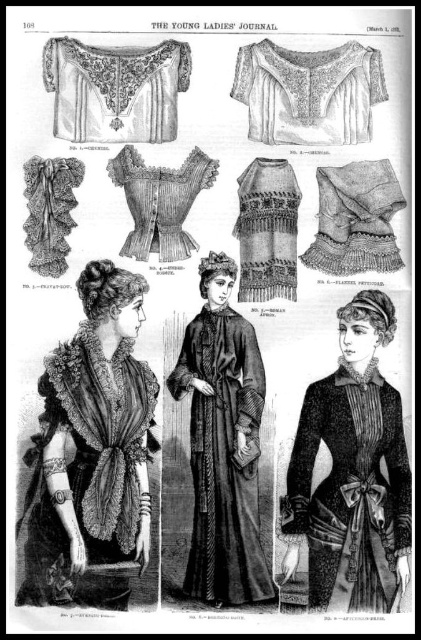
Between white lace blouse at upper center and matte white lace blouse at upper left, which one has more height?

Standing taller between the two is white lace blouse at upper center.

Does white lace blouse at upper center appear on the right side of matte white lace blouse at upper left?

Yes, white lace blouse at upper center is to the right of matte white lace blouse at upper left.

Does point (288, 99) come behind point (154, 48)?

No, it is not.

At what (x,y) coordinates should I click in order to perform the action: click on white lace blouse at upper center. Please return your answer as a coordinate pair (x, y). The width and height of the screenshot is (421, 640). Looking at the image, I should click on (309, 92).

Can you confirm if ruffled lace skirt at lower right is taller than matte white lace corset at center?

No, ruffled lace skirt at lower right is not taller than matte white lace corset at center.

Between point (391, 212) and point (122, 150), which one is positioned behind?

The point (122, 150) is behind.

Where is `ruffled lace skirt at lower right`? ruffled lace skirt at lower right is located at coordinates (356, 220).

Does velvet-like fabric dress at center appear on the right side of ruffled lace skirt at lower right?

Incorrect, velvet-like fabric dress at center is not on the right side of ruffled lace skirt at lower right.

Is point (149, 522) behind point (354, 180)?

No, (149, 522) is closer to viewer.

Between point (84, 561) and point (359, 264), which one is positioned in front?

Point (84, 561) is more forward.

Locate an element on the screen. velvet-like fabric dress at center is located at coordinates (92, 451).